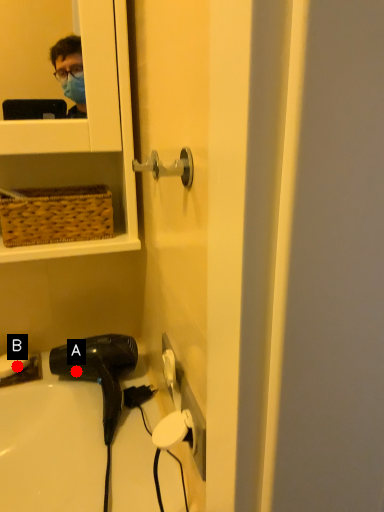
Question: Two points are circled on the image, labeled by A and B beside each circle. Which of the following is the closest to the observer?

Choices:
 (A) A is closer
 (B) B is closer

Answer: (A)